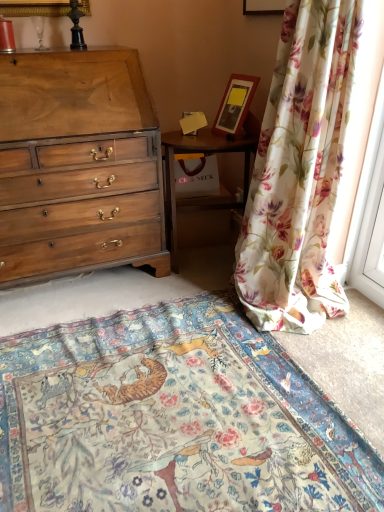
Question: Considering the relative sizes of wooden nightstand at center and floral fabric curtain at right in the image provided, is wooden nightstand at center thinner than floral fabric curtain at right?

Choices:
 (A) yes
 (B) no

Answer: (A)

Question: Can you confirm if wooden nightstand at center is shorter than floral fabric curtain at right?

Choices:
 (A) yes
 (B) no

Answer: (A)

Question: Is wooden nightstand at center aimed at floral fabric curtain at right?

Choices:
 (A) yes
 (B) no

Answer: (A)

Question: From the image's perspective, would you say wooden nightstand at center is positioned over floral fabric curtain at right?

Choices:
 (A) no
 (B) yes

Answer: (A)

Question: Can we say wooden nightstand at center lies outside floral fabric curtain at right?

Choices:
 (A) no
 (B) yes

Answer: (B)

Question: Looking at their shapes, would you say floral carpet at center is wider or thinner than wooden nightstand at center?

Choices:
 (A) thin
 (B) wide

Answer: (B)

Question: Is point (264, 359) positioned closer to the camera than point (221, 195)?

Choices:
 (A) closer
 (B) farther

Answer: (A)

Question: From a real-world perspective, is floral carpet at center physically located above or below wooden nightstand at center?

Choices:
 (A) above
 (B) below

Answer: (B)

Question: Which is correct: floral carpet at center is inside wooden nightstand at center, or outside of it?

Choices:
 (A) outside
 (B) inside

Answer: (A)

Question: From their relative heights in the image, would you say wooden picture frame at upper center, the 2th picture frame from the bottom, is taller or shorter than floral carpet at center?

Choices:
 (A) short
 (B) tall

Answer: (B)

Question: Is wooden picture frame at upper center, the 2th picture frame from the bottom, bigger or smaller than floral carpet at center?

Choices:
 (A) small
 (B) big

Answer: (A)

Question: Is point (274, 5) positioned closer to the camera than point (223, 309)?

Choices:
 (A) farther
 (B) closer

Answer: (A)

Question: Considering their positions, is wooden picture frame at upper center, which is the 1th picture frame in top-to-bottom order, located in front of or behind floral carpet at center?

Choices:
 (A) front
 (B) behind

Answer: (B)

Question: Based on their sizes in the image, would you say floral fabric curtain at right is bigger or smaller than floral carpet at center?

Choices:
 (A) big
 (B) small

Answer: (A)

Question: Is floral fabric curtain at right spatially inside floral carpet at center, or outside of it?

Choices:
 (A) outside
 (B) inside

Answer: (A)